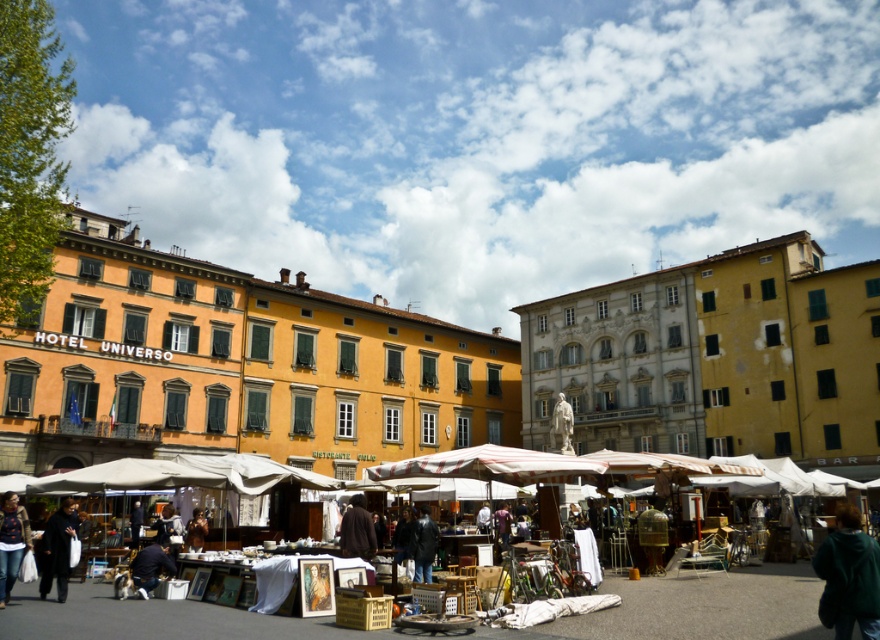
Question: Considering the relative positions of dark gray coat at lower left and dark brown leather jacket at center in the image provided, where is dark gray coat at lower left located with respect to dark brown leather jacket at center?

Choices:
 (A) above
 (B) below

Answer: (A)

Question: Which point is farther from the camera taking this photo?

Choices:
 (A) (255, 627)
 (B) (419, 566)
 (C) (198, 515)
 (D) (362, 545)

Answer: (C)

Question: Which of these objects is positioned farthest from the dark blue leather jacket at center?

Choices:
 (A) denim jacket at lower left
 (B) wooden crates at center

Answer: (A)

Question: Which point is closer to the camera taking this photo?

Choices:
 (A) (434, 541)
 (B) (765, 588)
 (C) (193, 541)

Answer: (A)

Question: Is green fuzzy jacket at lower right further to the viewer compared to denim jacket at lower left?

Choices:
 (A) yes
 (B) no

Answer: (B)

Question: Is green fuzzy jacket at lower right smaller than dark blue leather jacket at center?

Choices:
 (A) no
 (B) yes

Answer: (A)